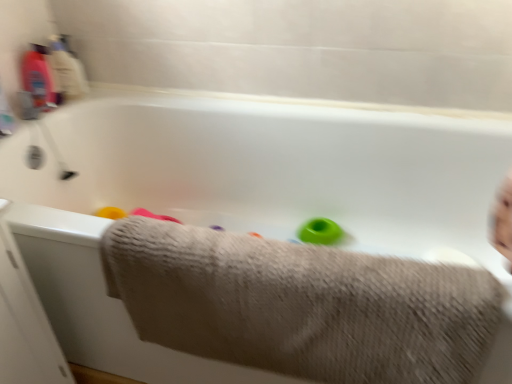
Question: Is green rubber ring at center looking in the opposite direction of beige textured towel at lower center?

Choices:
 (A) yes
 (B) no

Answer: (B)

Question: Does green rubber ring at center appear on the left side of beige textured towel at lower center?

Choices:
 (A) no
 (B) yes

Answer: (A)

Question: Is beige textured towel at lower center inside green rubber ring at center?

Choices:
 (A) yes
 (B) no

Answer: (B)

Question: From a real-world perspective, is green rubber ring at center physically above beige textured towel at lower center?

Choices:
 (A) yes
 (B) no

Answer: (B)

Question: From the image's perspective, is green rubber ring at center on top of beige textured towel at lower center?

Choices:
 (A) yes
 (B) no

Answer: (A)

Question: From the image's perspective, is green rubber ring at center positioned above or below translucent plastic bottle at upper left?

Choices:
 (A) above
 (B) below

Answer: (B)

Question: Is green rubber ring at center wider or thinner than translucent plastic bottle at upper left?

Choices:
 (A) wide
 (B) thin

Answer: (A)

Question: Considering the relative positions of green rubber ring at center and translucent plastic bottle at upper left in the image provided, is green rubber ring at center to the left or to the right of translucent plastic bottle at upper left?

Choices:
 (A) left
 (B) right

Answer: (B)

Question: Would you say green rubber ring at center is inside or outside translucent plastic bottle at upper left?

Choices:
 (A) inside
 (B) outside

Answer: (B)

Question: Looking at their shapes, would you say translucent plastic bottle at upper left is wider or thinner than green rubber ring at center?

Choices:
 (A) wide
 (B) thin

Answer: (B)

Question: Is translucent plastic bottle at upper left spatially inside green rubber ring at center, or outside of it?

Choices:
 (A) outside
 (B) inside

Answer: (A)

Question: In terms of height, does translucent plastic bottle at upper left look taller or shorter compared to green rubber ring at center?

Choices:
 (A) short
 (B) tall

Answer: (B)

Question: Would you say translucent plastic bottle at upper left is to the left or to the right of green rubber ring at center in the picture?

Choices:
 (A) right
 (B) left

Answer: (B)

Question: Visually, is green rubber ring at center positioned to the left or to the right of beige textured towel at lower center?

Choices:
 (A) left
 (B) right

Answer: (B)

Question: From the image's perspective, is green rubber ring at center above or below beige textured towel at lower center?

Choices:
 (A) above
 (B) below

Answer: (A)